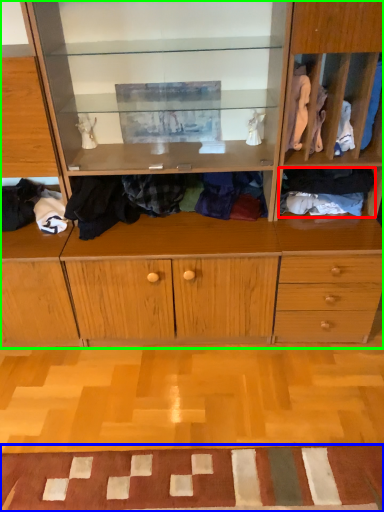
Question: Estimate the real-world distances between objects in this image. Which object is closer to clothing (highlighted by a red box), doormat (highlighted by a blue box) or cabinetry (highlighted by a green box)?

Choices:
 (A) doormat
 (B) cabinetry

Answer: (B)